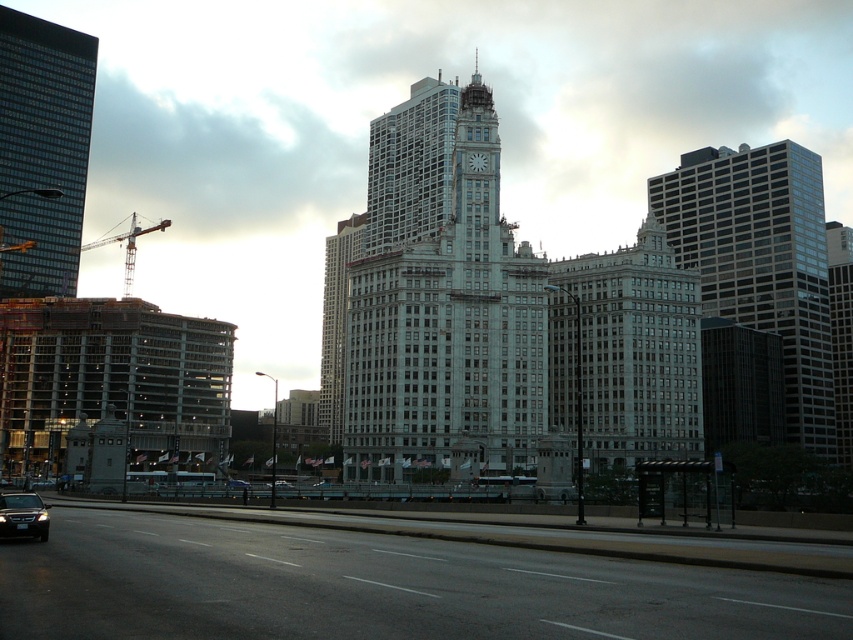
Question: Is white stone clock tower at center positioned in front of white marble clock at upper center?

Choices:
 (A) yes
 (B) no

Answer: (A)

Question: Does black asphalt highway at lower center have a greater width compared to gray glass building at center?

Choices:
 (A) no
 (B) yes

Answer: (B)

Question: Which object is positioned closest to the gray glass building at center?

Choices:
 (A) white stone clock tower at center
 (B) shiny black sedan at lower left
 (C) black asphalt highway at lower center
 (D) glassy reflective skyscraper at right

Answer: (A)

Question: Does white stone clock tower at center appear over gray glass building at center?

Choices:
 (A) no
 (B) yes

Answer: (B)

Question: Among these objects, which one is farthest from the camera?

Choices:
 (A) metallic construction crane at left
 (B) gray glass building at center
 (C) black asphalt highway at lower center
 (D) white marble clock at upper center

Answer: (A)

Question: Which point is closer to the camera?

Choices:
 (A) gray glass building at center
 (B) black asphalt highway at lower center
 (C) glassy reflective skyscraper at right

Answer: (B)